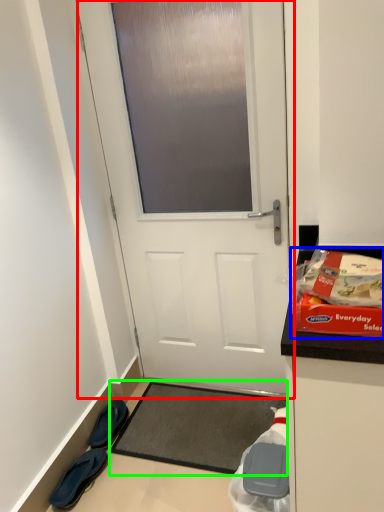
Question: Which object is the closest to the door (highlighted by a red box)? Choose among these: waste (highlighted by a blue box) or yoga mat (highlighted by a green box).

Choices:
 (A) waste
 (B) yoga mat

Answer: (B)